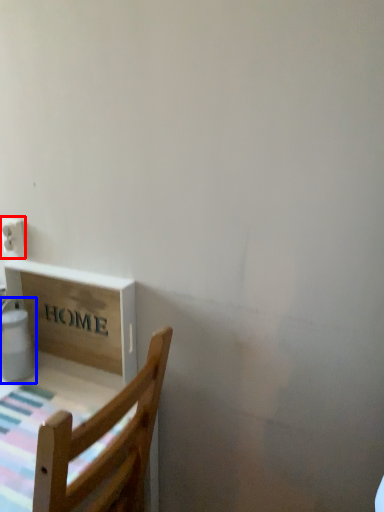
Question: Which of the following is the closest to the observer, electric outlet (highlighted by a red box) or water heater (highlighted by a blue box)?

Choices:
 (A) electric outlet
 (B) water heater

Answer: (B)